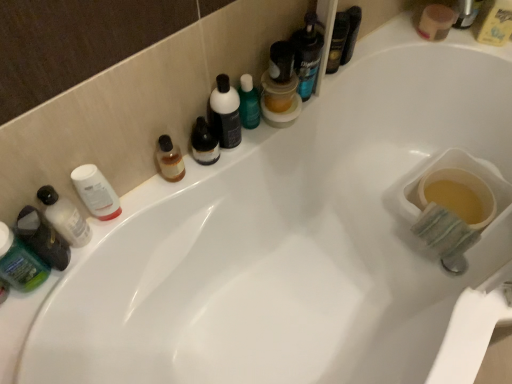
What is the approximate width of translucent plastic jar at upper center, the 2th mouthwash from the bottom?

The width of translucent plastic jar at upper center, the 2th mouthwash from the bottom, is 4.63 inches.

Image resolution: width=512 pixels, height=384 pixels. What are the coordinates of `yellow plastic bottle at upper right, which is the first mouthwash from back to front` in the screenshot? It's located at (494, 22).

What do you see at coordinates (20, 262) in the screenshot? I see `green matte bottle at left, which appears as the fourth mouthwash when viewed from the right` at bounding box center [20, 262].

Describe the element at coordinates (96, 192) in the screenshot. I see `white matte lotion at left, the 3th toiletry when ordered from left to right` at that location.

Where is `matte black bottle at center, marked as the first toiletry in a right-to-left arrangement`? This screenshot has width=512, height=384. matte black bottle at center, marked as the first toiletry in a right-to-left arrangement is located at coordinates (225, 113).

Find the location of a particular element. This screenshot has width=512, height=384. translucent plastic bottle at left, positioned as the 3th toiletry in right-to-left order is located at coordinates (64, 217).

From a real-world perspective, is translucent plastic jar at upper center, placed as the 2th mouthwash when sorted from front to back, physically located above or below translucent plastic bottle at left, which is the second toiletry from left to right?

Clearly, from a real-world perspective, translucent plastic jar at upper center, placed as the 2th mouthwash when sorted from front to back, is below translucent plastic bottle at left, which is the second toiletry from left to right.

From the image's perspective, is translucent plastic jar at upper center, which is the 3th mouthwash in back-to-front order, under translucent plastic bottle at left, which is the second toiletry from left to right?

No, from the image's perspective, translucent plastic jar at upper center, which is the 3th mouthwash in back-to-front order, is not below translucent plastic bottle at left, which is the second toiletry from left to right.

Is translucent plastic jar at upper center, placed as the 2th mouthwash when sorted from front to back, placed right next to translucent plastic bottle at left, positioned as the 3th toiletry in right-to-left order?

No.

Based on the photo, can you confirm if matte black bottle at center, marked as the first toiletry in a right-to-left arrangement, is positioned to the right of yellow plastic bottle at upper right, which is the first mouthwash from back to front?

In fact, matte black bottle at center, marked as the first toiletry in a right-to-left arrangement, is to the left of yellow plastic bottle at upper right, which is the first mouthwash from back to front.

How different are the orientations of matte black bottle at center, marked as the first toiletry in a right-to-left arrangement, and yellow plastic bottle at upper right, positioned as the 4th mouthwash in bottom-to-top order, in degrees?

They differ by 39.8 degrees in their facing directions.

Which object is closer to the camera, matte black bottle at center, the fourth toiletry viewed from the left, or yellow plastic bottle at upper right, positioned as the 4th mouthwash in bottom-to-top order?

matte black bottle at center, the fourth toiletry viewed from the left, is more forward.

Does point (105, 220) come behind point (216, 91)?

Yes.

From a real-world perspective, who is located lower, white matte lotion at left, the 3th toiletry when ordered from left to right, or matte black bottle at center, the fourth toiletry viewed from the left?

white matte lotion at left, the 3th toiletry when ordered from left to right, from a real-world perspective.

Which is more to the left, white matte lotion at left, the 3th toiletry when ordered from left to right, or matte black bottle at center, marked as the first toiletry in a right-to-left arrangement?

Positioned to the left is white matte lotion at left, the 3th toiletry when ordered from left to right.

Looking at this image, can you confirm if matte black bottle at center, marked as the first toiletry in a right-to-left arrangement, is taller than translucent plastic jar at upper center, placed as the 2th mouthwash when sorted from front to back?

Correct, matte black bottle at center, marked as the first toiletry in a right-to-left arrangement, is much taller as translucent plastic jar at upper center, placed as the 2th mouthwash when sorted from front to back.

Can translucent plastic jar at upper center, placed as the 2th mouthwash when sorted from front to back, be found inside matte black bottle at center, the fourth toiletry viewed from the left?

Definitely not — translucent plastic jar at upper center, placed as the 2th mouthwash when sorted from front to back, is not inside matte black bottle at center, the fourth toiletry viewed from the left.

How many degrees apart are the facing directions of matte black bottle at center, the fourth toiletry viewed from the left, and translucent plastic jar at upper center, which is counted as the third mouthwash, starting from the right?

The angle between the facing direction of matte black bottle at center, the fourth toiletry viewed from the left, and the facing direction of translucent plastic jar at upper center, which is counted as the third mouthwash, starting from the right, is 0.000182 degrees.

Can you confirm if matte black bottle at center, marked as the first toiletry in a right-to-left arrangement, is bigger than translucent plastic jar at upper center, placed as the 2th mouthwash when sorted from front to back?

No, matte black bottle at center, marked as the first toiletry in a right-to-left arrangement, is not bigger than translucent plastic jar at upper center, placed as the 2th mouthwash when sorted from front to back.

Locate an element on the screen. The width and height of the screenshot is (512, 384). the 2nd toiletry directly beneath the matte black bottle at center, the fourth toiletry viewed from the left (from a real-world perspective) is located at coordinates (96, 192).

Can you confirm if matte black bottle at center, marked as the first toiletry in a right-to-left arrangement, is wider than white matte lotion at left, the second toiletry viewed from the right?

Correct, the width of matte black bottle at center, marked as the first toiletry in a right-to-left arrangement, exceeds that of white matte lotion at left, the second toiletry viewed from the right.

From a real-world perspective, relative to white matte lotion at left, the 3th toiletry when ordered from left to right, is matte black bottle at center, marked as the first toiletry in a right-to-left arrangement, vertically above or below?

matte black bottle at center, marked as the first toiletry in a right-to-left arrangement, is above white matte lotion at left, the 3th toiletry when ordered from left to right.

Is yellow plastic bottle at upper right, which is counted as the 4th mouthwash, starting from the left, taller or shorter than white matte lotion at left, the 3th toiletry when ordered from left to right?

Clearly, yellow plastic bottle at upper right, which is counted as the 4th mouthwash, starting from the left, is shorter compared to white matte lotion at left, the 3th toiletry when ordered from left to right.

Does yellow plastic bottle at upper right, which is counted as the 4th mouthwash, starting from the left, have a greater width compared to white matte lotion at left, the 3th toiletry when ordered from left to right?

Yes.

Could you tell me if yellow plastic bottle at upper right, which is counted as the 4th mouthwash, starting from the left, is facing white matte lotion at left, the second toiletry viewed from the right?

No, yellow plastic bottle at upper right, which is counted as the 4th mouthwash, starting from the left, is not facing towards white matte lotion at left, the second toiletry viewed from the right.

Considering the positions of points (489, 37) and (76, 168), is point (489, 37) closer to camera compared to point (76, 168)?

That is False.

From the image's perspective, is matte black bottle at center, the fourth toiletry viewed from the left, above or below translucent plastic bottle at left, which is the second toiletry from left to right?

Clearly, from the image's perspective, matte black bottle at center, the fourth toiletry viewed from the left, is above translucent plastic bottle at left, which is the second toiletry from left to right.

Is matte black bottle at center, marked as the first toiletry in a right-to-left arrangement, shorter than translucent plastic bottle at left, which is the second toiletry from left to right?

No.

Which object is thinner, matte black bottle at center, the fourth toiletry viewed from the left, or translucent plastic bottle at left, positioned as the 3th toiletry in right-to-left order?

With smaller width is matte black bottle at center, the fourth toiletry viewed from the left.

How different are the orientations of matte black bottle at center, the fourth toiletry viewed from the left, and translucent plastic bottle at left, which is the second toiletry from left to right, in degrees?

There is a 5.37-degree angle between the facing directions of matte black bottle at center, the fourth toiletry viewed from the left, and translucent plastic bottle at left, which is the second toiletry from left to right.

Starting from the translucent plastic bottle at left, positioned as the 3th toiletry in right-to-left order, which mouthwash is the 1st one behind? Please provide its 2D coordinates.

[(280, 87)]

Which toiletry is the 1st one when counting from the front of the yellow plastic bottle at upper right, which is the first mouthwash from back to front? Please provide its 2D coordinates.

[(225, 113)]

Looking at the image, which one is located closer to yellow plastic bottle at upper right, marked as the first mouthwash in a right-to-left arrangement, green matte bottle at left, which appears as the fourth mouthwash when viewed from the right, or green matte lotion at left, the 1th toiletry in the left-to-right sequence?

Based on the image, green matte lotion at left, the 1th toiletry in the left-to-right sequence, appears to be nearer to yellow plastic bottle at upper right, marked as the first mouthwash in a right-to-left arrangement.

Looking at the image, which one is located further to green matte lotion at left, arranged as the fourth toiletry when viewed from the right, yellow plastic bottle at upper right, which is the first mouthwash from back to front, or green matte bottle at left, which is the first mouthwash in left-to-right order?

yellow plastic bottle at upper right, which is the first mouthwash from back to front, is positioned further to the anchor green matte lotion at left, arranged as the fourth toiletry when viewed from the right.

Looking at this image, when comparing their distances from translucent plastic mouthwash at upper center, which ranks as the third mouthwash in bottom-to-top order, does translucent plastic jar at upper center, which is the 3th mouthwash in back-to-front order, or translucent plastic bottle at left, positioned as the 3th toiletry in right-to-left order, seem closer?

The object closer to translucent plastic mouthwash at upper center, which ranks as the third mouthwash in bottom-to-top order, is translucent plastic jar at upper center, which is the 3th mouthwash in back-to-front order.

From the image, which object appears to be farther from matte black bottle at center, marked as the first toiletry in a right-to-left arrangement, translucent plastic jar at upper center, the 2th mouthwash from the bottom, or translucent plastic bottle at left, positioned as the 3th toiletry in right-to-left order?

translucent plastic bottle at left, positioned as the 3th toiletry in right-to-left order.

Considering their positions, is translucent plastic mouthwash at upper center, marked as the 3th mouthwash in a left-to-right arrangement, positioned closer to matte black bottle at center, the fourth toiletry viewed from the left, than white matte lotion at left, the second toiletry viewed from the right?

Among the two, white matte lotion at left, the second toiletry viewed from the right, is located nearer to matte black bottle at center, the fourth toiletry viewed from the left.

When comparing their distances from translucent plastic jar at upper center, the 2th mouthwash from the bottom, does green matte lotion at left, the 1th toiletry in the left-to-right sequence, or translucent plastic mouthwash at upper center, the 2th mouthwash in the back-to-front sequence, seem further?

green matte lotion at left, the 1th toiletry in the left-to-right sequence, is positioned further to the anchor translucent plastic jar at upper center, the 2th mouthwash from the bottom.

Estimate the real-world distances between objects in this image. Which object is further from matte black bottle at center, the fourth toiletry viewed from the left, white matte lotion at left, the 3th toiletry when ordered from left to right, or translucent plastic mouthwash at upper center, which is counted as the second mouthwash, starting from the right?

translucent plastic mouthwash at upper center, which is counted as the second mouthwash, starting from the right, lies further to matte black bottle at center, the fourth toiletry viewed from the left, than the other object.

Consider the image. When comparing their distances from translucent plastic jar at upper center, placed as the 2th mouthwash when sorted from front to back, does translucent plastic bottle at left, which is the second toiletry from left to right, or yellow plastic bottle at upper right, which is counted as the 4th mouthwash, starting from the left, seem further?

Based on the image, yellow plastic bottle at upper right, which is counted as the 4th mouthwash, starting from the left, appears to be further to translucent plastic jar at upper center, placed as the 2th mouthwash when sorted from front to back.

At what (x,y) coordinates should I click in order to perform the action: click on toiletry located between white matte lotion at left, the second toiletry viewed from the right, and translucent plastic jar at upper center, positioned as the second mouthwash in left-to-right order, in the left-right direction. Please return your answer as a coordinate pair (x, y). This screenshot has height=384, width=512. Looking at the image, I should click on (225, 113).

Locate an element on the screen. The image size is (512, 384). mouthwash between white matte lotion at left, the second toiletry viewed from the right, and translucent plastic mouthwash at upper center, the 2th mouthwash when ordered from top to bottom is located at coordinates (280, 87).

Where is `toiletry between green matte bottle at left, the first mouthwash from the bottom, and translucent plastic bottle at left, positioned as the 3th toiletry in right-to-left order, from left to right`? The height and width of the screenshot is (384, 512). toiletry between green matte bottle at left, the first mouthwash from the bottom, and translucent plastic bottle at left, positioned as the 3th toiletry in right-to-left order, from left to right is located at coordinates (42, 238).

Find the location of a particular element. toiletry between translucent plastic bottle at left, positioned as the 3th toiletry in right-to-left order, and matte black bottle at center, marked as the first toiletry in a right-to-left arrangement is located at coordinates (96, 192).